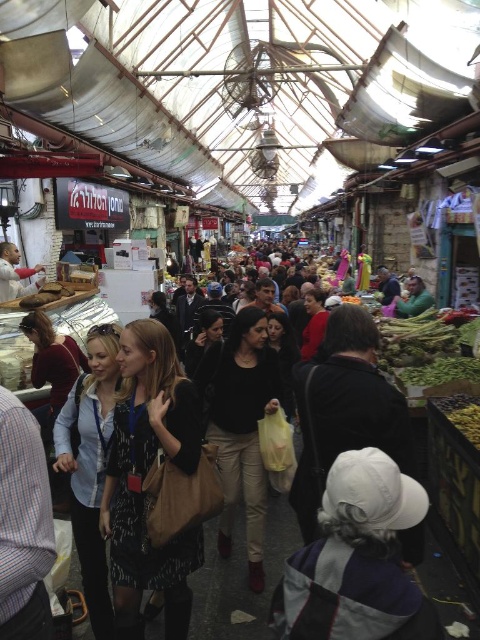
You are a photographer standing in the market and want to take a photo of both the black matte shirt at center and the matte white shirt at center. Which shirt should you focus on first to ensure both are in focus?

You should focus on the black matte shirt at center first because it is closer to the viewer than the matte white shirt at center, so by focusing on the closer one, both will be in focus.

You are a customer in the market and want to pick up both the patterned fabric dress at center and the matte blue shirt at center. If you can reach items within 5 feet, can you grab both without moving your position?

The patterned fabric dress at center is 5.38 feet away from matte blue shirt at center. Since the distance between them is more than 5 feet, you cannot grab both items without moving your position.

You are standing at point A at the market entrance. You see a vendor at point B located at point (360, 496). The distance between you and the vendor is 23.69 feet. If you want to walk directly to the vendor, how many steps would you need to take if each step covers 2.5 feet?

The distance between you and the vendor at point (360, 496) is 23.69 feet. Since each step covers 2.5 feet, you would need to take approximately 23.69 divided by 2.5, which equals about 9.48 steps. Since you can only take whole steps, you would need to take 10 steps to reach the vendor.